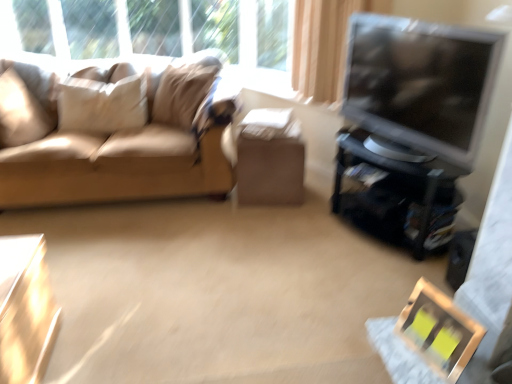
Locate an element on the screen. vacant area that lies between matte cardboard box at center, which is the first table from right to left, and wooden picture frame at lower right is located at coordinates (323, 246).